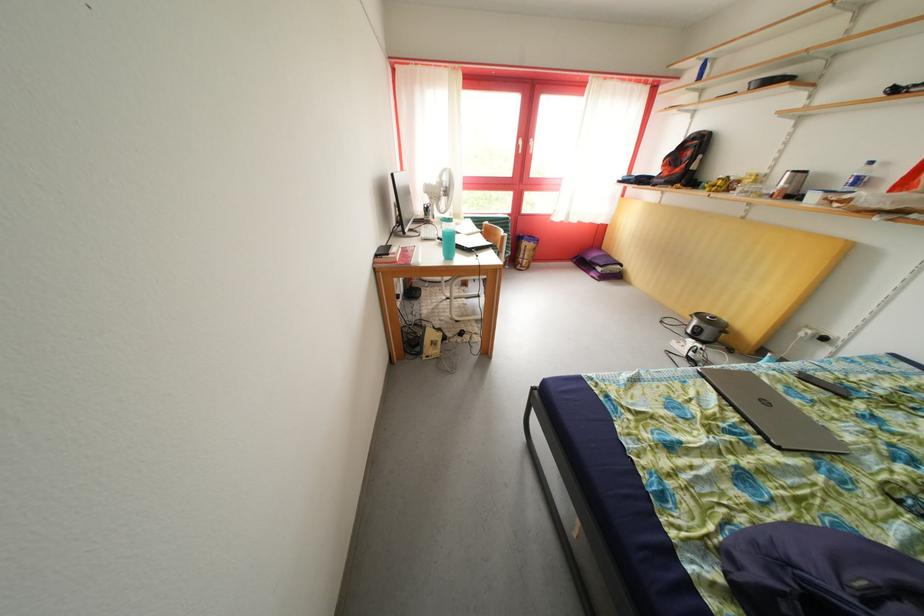
The height and width of the screenshot is (616, 924). Identify the location of the right white window handle. (530, 145).